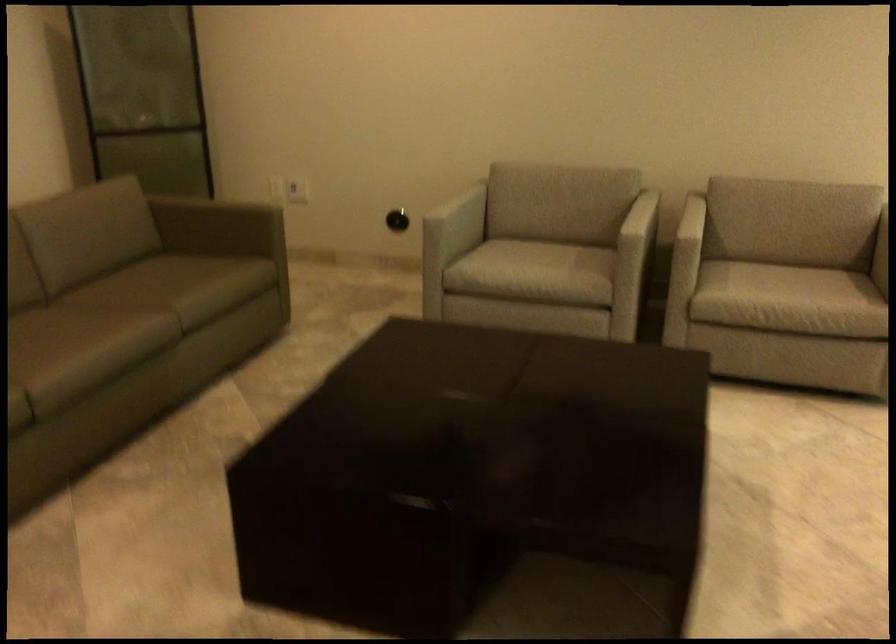
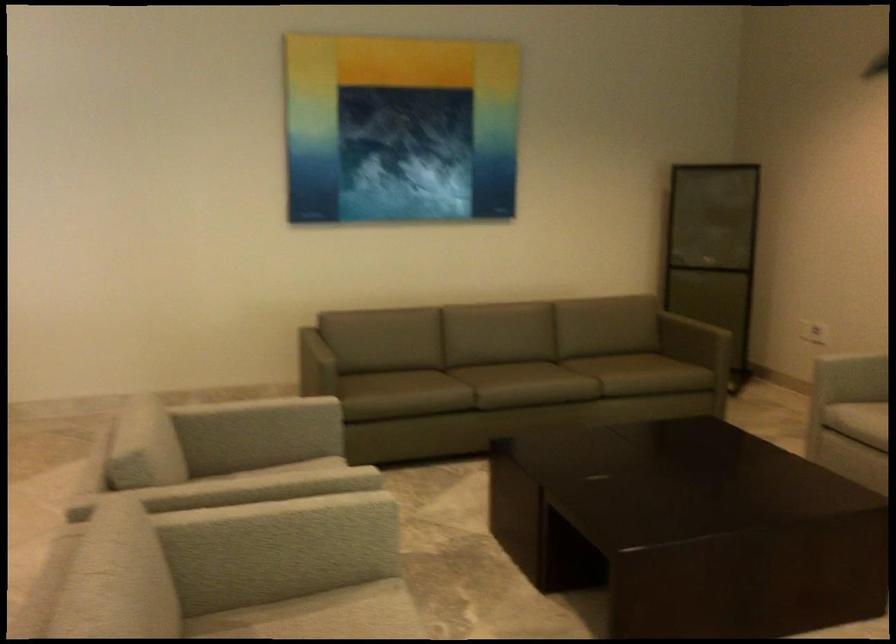
In the second image, find the point that corresponds to [196,185] in the first image.

(713, 317)